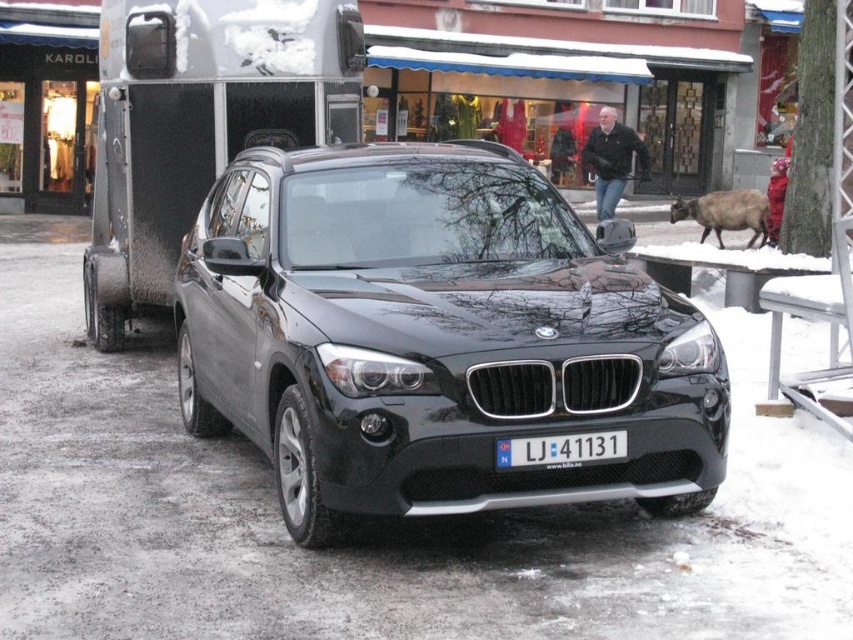
Question: Is glossy black suv at center smaller than metallic silver trailer at left?

Choices:
 (A) no
 (B) yes

Answer: (A)

Question: Is glossy black suv at center below white plastic license plate at center?

Choices:
 (A) yes
 (B) no

Answer: (B)

Question: Among these objects, which one is farthest from the camera?

Choices:
 (A) metallic silver trailer at left
 (B) white plastic license plate at center
 (C) glossy black suv at center
 (D) brown furry goat at right

Answer: (D)

Question: Which of the following is the closest to the observer?

Choices:
 (A) brown furry goat at right
 (B) glossy black suv at center
 (C) white plastic license plate at center

Answer: (B)

Question: Which object is farther from the camera taking this photo?

Choices:
 (A) glossy black suv at center
 (B) metallic silver trailer at left

Answer: (B)

Question: Does metallic silver trailer at left have a greater width compared to white plastic license plate at center?

Choices:
 (A) yes
 (B) no

Answer: (A)